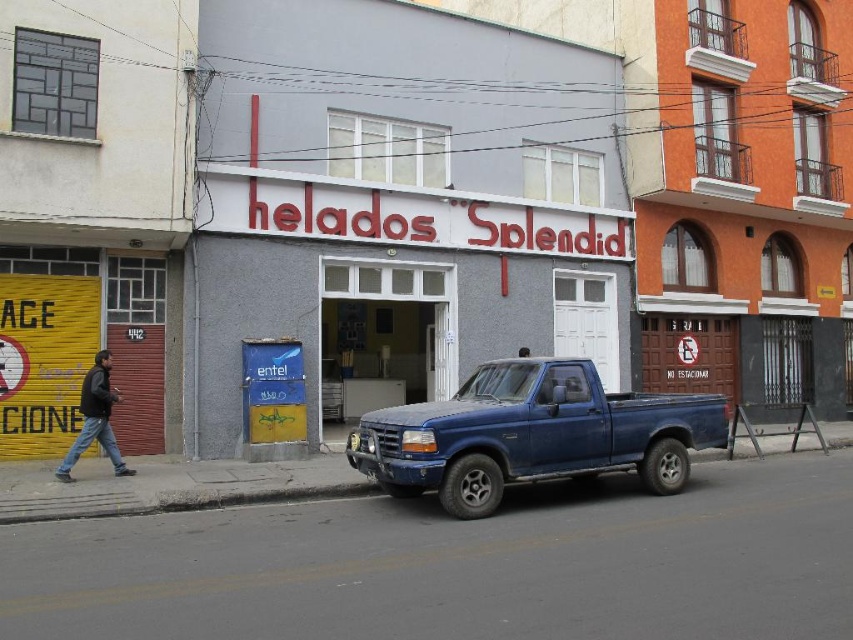
Can you confirm if matte blue truck at center is taller than dark blue jeans at lower left?

In fact, matte blue truck at center may be shorter than dark blue jeans at lower left.

Consider the image. Is matte blue truck at center thinner than dark blue jeans at lower left?

No.

This screenshot has width=853, height=640. Describe the element at coordinates (532, 435) in the screenshot. I see `matte blue truck at center` at that location.

Locate an element on the screen. The height and width of the screenshot is (640, 853). matte blue truck at center is located at coordinates (532, 435).